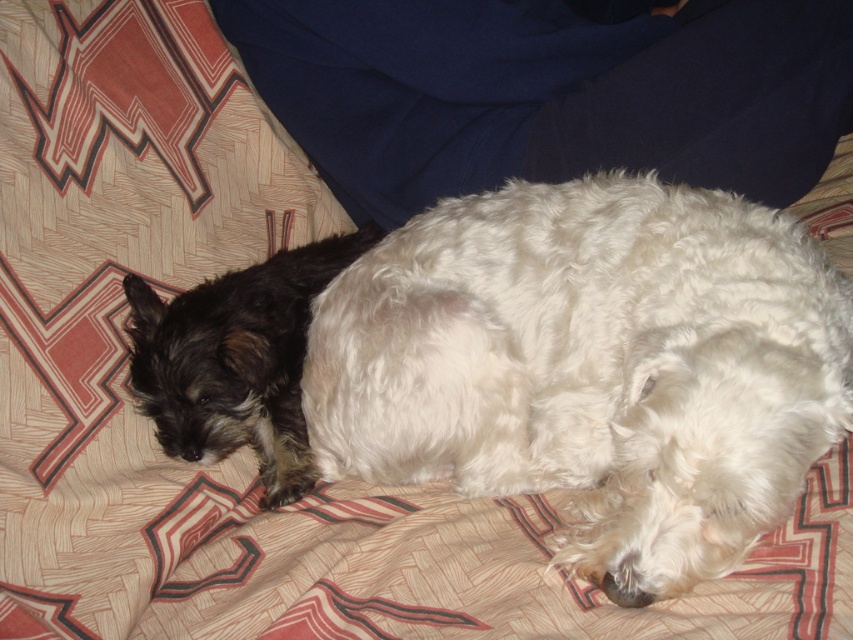
Can you confirm if white fluffy dog at center is shorter than shaggy black dog at left?

No, white fluffy dog at center is not shorter than shaggy black dog at left.

Can you confirm if white fluffy dog at center is taller than shaggy black dog at left?

Yes.

Who is more distant from viewer, (799, 236) or (138, 276)?

Positioned behind is point (138, 276).

Find the location of `white fluffy dog at center`. white fluffy dog at center is located at coordinates (592, 365).